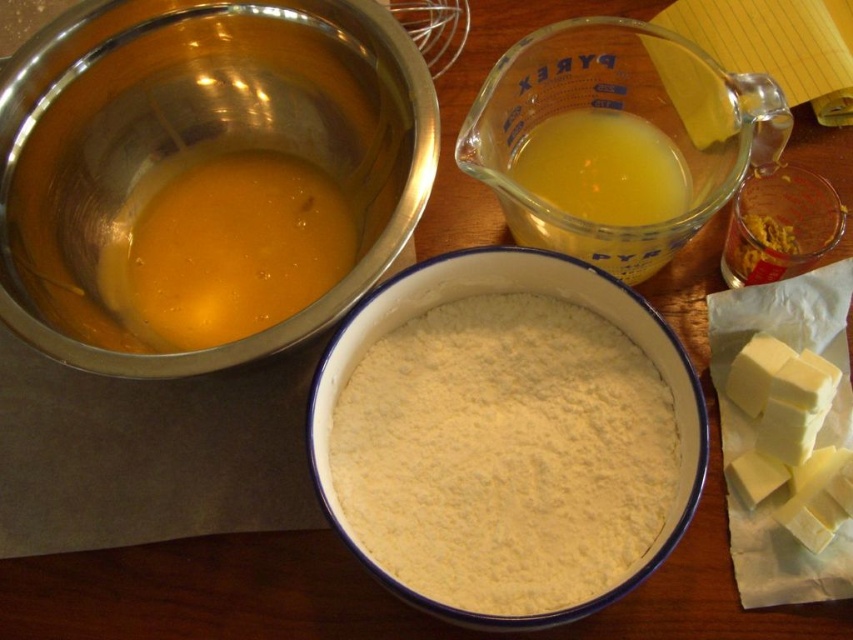
Question: Which point is farther to the camera?

Choices:
 (A) translucent glass measuring cup at upper center
 (B) white powder at center
 (C) yellow crumbly mixture at upper right
 (D) golden liquid at upper left

Answer: (D)

Question: Estimate the real-world distances between objects in this image. Which object is farther from the yellow crumbly mixture at upper right?

Choices:
 (A) shiny metallic bowl at upper left
 (B) white powder at center
 (C) translucent glass measuring cup at upper center
 (D) golden liquid at upper left

Answer: (A)

Question: Does white powder at center have a greater width compared to translucent glass measuring cup at upper center?

Choices:
 (A) yes
 (B) no

Answer: (A)

Question: Which of the following is the closest to the observer?

Choices:
 (A) click(764, 260)
 (B) click(370, 20)
 (C) click(659, 420)
 (D) click(325, 241)

Answer: (C)

Question: Observing the image, what is the correct spatial positioning of shiny metallic bowl at upper left in reference to golden liquid at upper left?

Choices:
 (A) below
 (B) above

Answer: (B)

Question: Is golden liquid at upper left wider than yellow crumbly mixture at upper right?

Choices:
 (A) yes
 (B) no

Answer: (A)